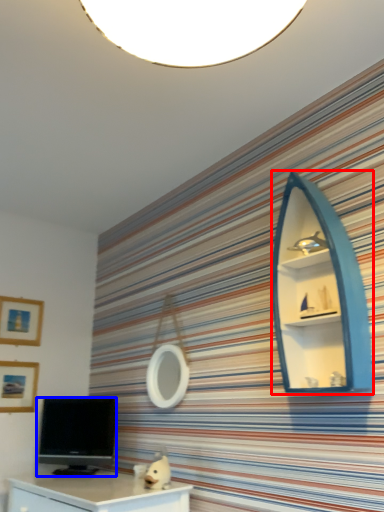
Question: Which of the following is the farthest to the observer, shelf (highlighted by a red box) or television (highlighted by a blue box)?

Choices:
 (A) shelf
 (B) television

Answer: (B)